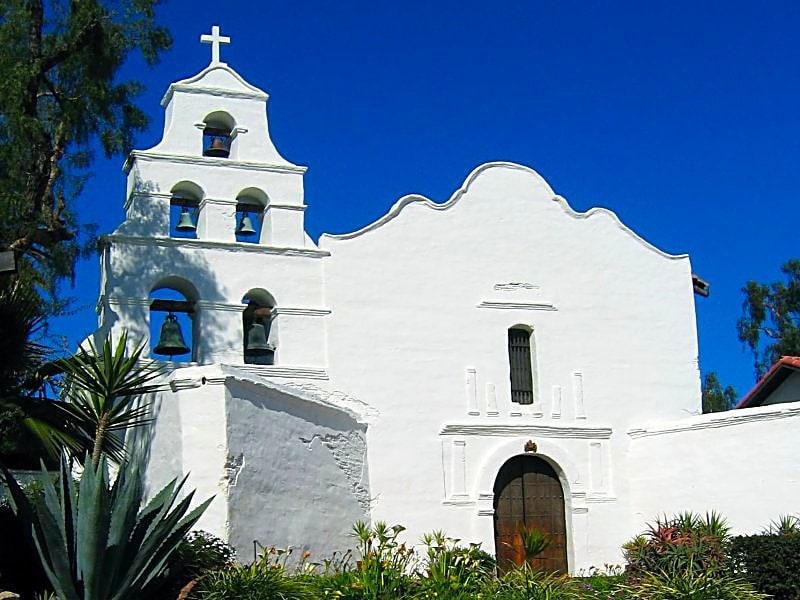
The width and height of the screenshot is (800, 600). I want to click on arched doorway, so click(550, 459).